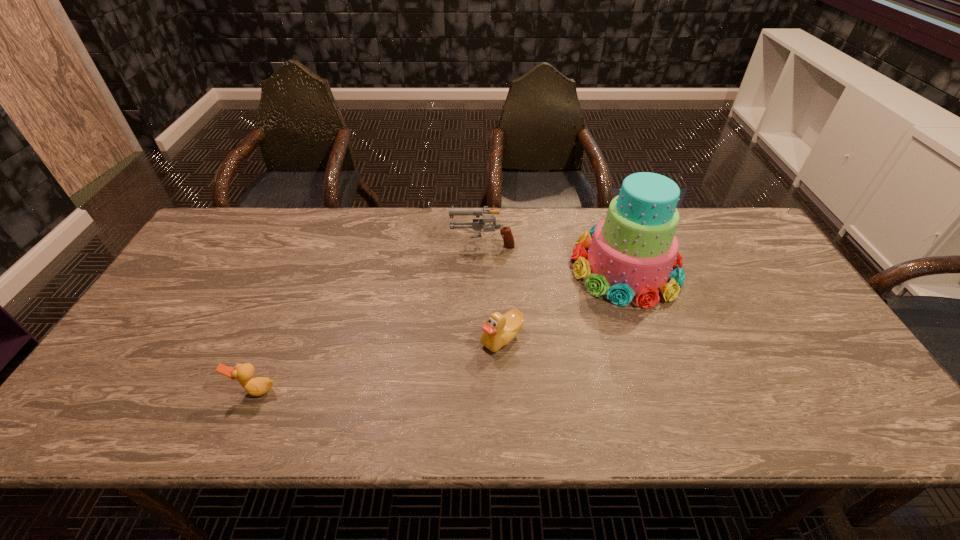
Locate an element on the screen. Image resolution: width=960 pixels, height=540 pixels. vacant space that satisfies the following two spatial constraints: 1. at the beak of the third farthest object; 2. on the beak of the nearest object is located at coordinates (504, 390).

Identify the location of free space that satisfies the following two spatial constraints: 1. at the barrel end of the rightmost object; 2. on the left side of the third shortest object. The height and width of the screenshot is (540, 960). (483, 267).